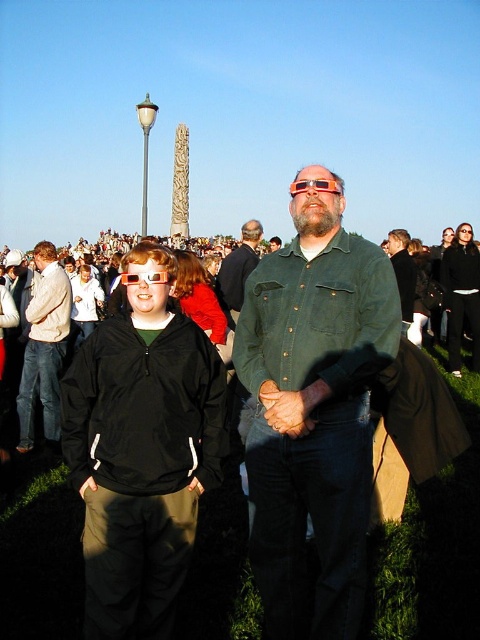
Who is positioned more to the right, translucent orange goggles at center or red plastic glasses at center?

translucent orange goggles at center is more to the right.

Which is behind, point (332, 186) or point (168, 278)?

Point (168, 278)

Is point (303, 188) in front of point (126, 275)?

No.

Image resolution: width=480 pixels, height=640 pixels. In order to click on translucent orange goggles at center in this screenshot , I will do `click(315, 186)`.

Between matte black jacket at left and red plastic glasses at center, which one is positioned higher?

red plastic glasses at center is higher up.

Is matte black jacket at left to the right of red plastic glasses at center from the viewer's perspective?

No, matte black jacket at left is not to the right of red plastic glasses at center.

Describe the element at coordinates (44, 348) in the screenshot. The width and height of the screenshot is (480, 640). I see `matte black jacket at left` at that location.

This screenshot has width=480, height=640. In order to click on matte black jacket at left in this screenshot , I will do `click(44, 348)`.

Which is behind, point (187, 536) or point (467, 282)?

Point (467, 282)

Is matte black jacket at center closer to camera compared to black leather jacket at center?

Yes, it is in front of black leather jacket at center.

Which is in front, point (140, 362) or point (456, 248)?

Point (140, 362)

Locate an element on the screen. matte black jacket at center is located at coordinates (142, 452).